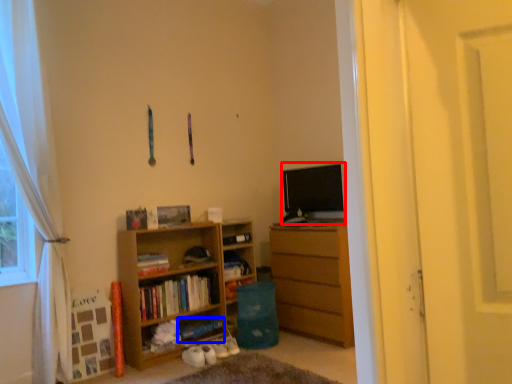
Question: Among these objects, which one is farthest to the camera, open (highlighted by a red box) or book (highlighted by a blue box)?

Choices:
 (A) open
 (B) book

Answer: (A)